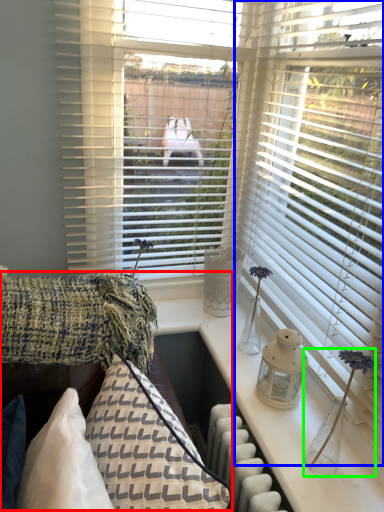
Question: Considering the real-world distances, which object is closest to couch (highlighted by a red box)? window blind (highlighted by a blue box) or table lamp (highlighted by a green box).

Choices:
 (A) window blind
 (B) table lamp

Answer: (B)